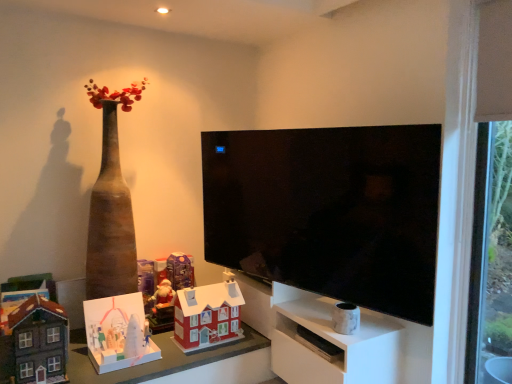
Question: Is matte cardboard table at lower center inside transparent glass door at right?

Choices:
 (A) yes
 (B) no

Answer: (B)

Question: Can you confirm if transparent glass door at right is bigger than matte cardboard table at lower center?

Choices:
 (A) yes
 (B) no

Answer: (B)

Question: Is transparent glass door at right in contact with matte cardboard table at lower center?

Choices:
 (A) no
 (B) yes

Answer: (A)

Question: Could you tell me if transparent glass door at right is turned towards matte cardboard table at lower center?

Choices:
 (A) no
 (B) yes

Answer: (A)

Question: Can you confirm if transparent glass door at right is thinner than matte cardboard table at lower center?

Choices:
 (A) no
 (B) yes

Answer: (B)

Question: Is matte cardboard table at lower center wider or thinner than white marble vase at lower right, placed as the fifth toy when sorted from left to right?

Choices:
 (A) wide
 (B) thin

Answer: (A)

Question: From a real-world perspective, is matte cardboard table at lower center physically located above or below white marble vase at lower right, placed as the fifth toy when sorted from left to right?

Choices:
 (A) below
 (B) above

Answer: (A)

Question: From the image's perspective, is matte cardboard table at lower center above or below white marble vase at lower right, placed as the fifth toy when sorted from left to right?

Choices:
 (A) above
 (B) below

Answer: (B)

Question: Is matte cardboard table at lower center taller or shorter than white marble vase at lower right, placed as the fifth toy when sorted from left to right?

Choices:
 (A) short
 (B) tall

Answer: (A)

Question: From the image's perspective, is matte purple toy at center, which ranks as the 3th toy in right-to-left order, positioned above or below matte cardboard table at lower center?

Choices:
 (A) above
 (B) below

Answer: (A)

Question: From their relative heights in the image, would you say matte purple toy at center, which ranks as the 3th toy in right-to-left order, is taller or shorter than matte cardboard table at lower center?

Choices:
 (A) short
 (B) tall

Answer: (B)

Question: From a real-world perspective, is matte purple toy at center, the 3th toy positioned from the left, above or below matte cardboard table at lower center?

Choices:
 (A) above
 (B) below

Answer: (A)

Question: Relative to matte cardboard table at lower center, is matte purple toy at center, which ranks as the 3th toy in right-to-left order, in front or behind?

Choices:
 (A) behind
 (B) front

Answer: (A)

Question: Is matte cardboard table at lower center situated inside transparent glass door at right or outside?

Choices:
 (A) outside
 (B) inside

Answer: (A)

Question: From a real-world perspective, relative to transparent glass door at right, is matte cardboard table at lower center vertically above or below?

Choices:
 (A) above
 (B) below

Answer: (B)